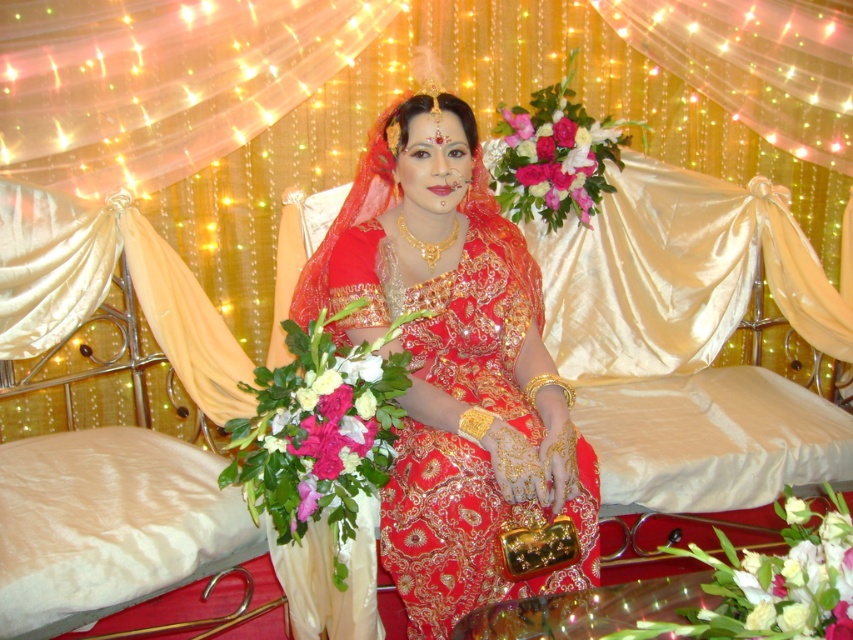
Question: Does pink silk flower at center have a larger size compared to pink silk bouquet at center?

Choices:
 (A) no
 (B) yes

Answer: (B)

Question: Which object appears closest to the camera in this image?

Choices:
 (A) pink silk bouquet at center
 (B) matte gold jewelry at center
 (C) pink silk flower at center

Answer: (B)

Question: Based on their relative distances, which object is farther from the pink silk bouquet at center?

Choices:
 (A) matte gold jewelry at center
 (B) pink silk flower at center

Answer: (B)

Question: Observing the image, what is the correct spatial positioning of matte gold jewelry at center in reference to pink silk bouquet at center?

Choices:
 (A) below
 (B) above

Answer: (A)

Question: Which point is closer to the camera?

Choices:
 (A) (525, 205)
 (B) (492, 196)

Answer: (B)

Question: Does matte gold jewelry at center lie in front of pink silk flower at center?

Choices:
 (A) yes
 (B) no

Answer: (A)